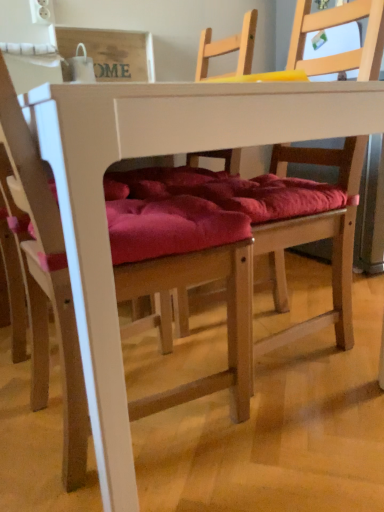
Question: From a real-world perspective, is white matte table at center located higher than wooden chair with red cushion at center, which is counted as the first chair, starting from the right?

Choices:
 (A) yes
 (B) no

Answer: (B)

Question: Can we say white matte table at center lies outside wooden chair with red cushion at center, acting as the second chair starting from the left?

Choices:
 (A) no
 (B) yes

Answer: (B)

Question: Is wooden chair with red cushion at center, which is counted as the first chair, starting from the right, completely or partially inside white matte table at center?

Choices:
 (A) yes
 (B) no

Answer: (A)

Question: From the image's perspective, is white matte table at center on top of wooden chair with red cushion at center, which is counted as the first chair, starting from the right?

Choices:
 (A) yes
 (B) no

Answer: (B)

Question: Does white matte table at center have a larger size compared to wooden chair with red cushion at center, which is counted as the first chair, starting from the right?

Choices:
 (A) yes
 (B) no

Answer: (A)

Question: From the image's perspective, relative to white matte table at center, is wooden chair with red cushion at center, which is counted as the first chair, starting from the right, above or below?

Choices:
 (A) below
 (B) above

Answer: (B)

Question: Relative to white matte table at center, is wooden chair with red cushion at center, which is counted as the first chair, starting from the right, in front or behind?

Choices:
 (A) front
 (B) behind

Answer: (B)

Question: Looking at their shapes, would you say wooden chair with red cushion at center, which is counted as the first chair, starting from the right, is wider or thinner than white matte table at center?

Choices:
 (A) thin
 (B) wide

Answer: (A)

Question: Would you say wooden chair with red cushion at center, which is counted as the first chair, starting from the right, is inside or outside white matte table at center?

Choices:
 (A) inside
 (B) outside

Answer: (A)

Question: From their relative heights in the image, would you say white matte table at center is taller or shorter than velvet red cushion at center, which is the 2th chair in right-to-left order?

Choices:
 (A) short
 (B) tall

Answer: (A)

Question: Considering the positions of white matte table at center and velvet red cushion at center, which is the 2th chair in right-to-left order, in the image, is white matte table at center bigger or smaller than velvet red cushion at center, which is the 2th chair in right-to-left order,?

Choices:
 (A) small
 (B) big

Answer: (B)

Question: From a real-world perspective, relative to velvet red cushion at center, which is the 2th chair in right-to-left order, is white matte table at center vertically above or below?

Choices:
 (A) below
 (B) above

Answer: (A)

Question: Based on their positions, is white matte table at center located to the left or right of velvet red cushion at center, which is the 2th chair in right-to-left order?

Choices:
 (A) right
 (B) left

Answer: (A)

Question: Considering their positions, is wooden chair with red cushion at center, acting as the second chair starting from the left, located in front of or behind velvet red cushion at center, which is the 2th chair in right-to-left order?

Choices:
 (A) front
 (B) behind

Answer: (B)

Question: Is wooden chair with red cushion at center, which is counted as the first chair, starting from the right, taller or shorter than velvet red cushion at center, which is the 2th chair in right-to-left order?

Choices:
 (A) tall
 (B) short

Answer: (A)